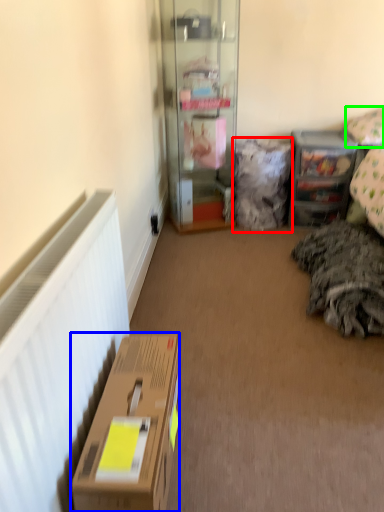
Question: Which object is positioned closest to pillow (highlighted by a red box)? Select from box (highlighted by a blue box) and pillow (highlighted by a green box).

Choices:
 (A) box
 (B) pillow

Answer: (B)